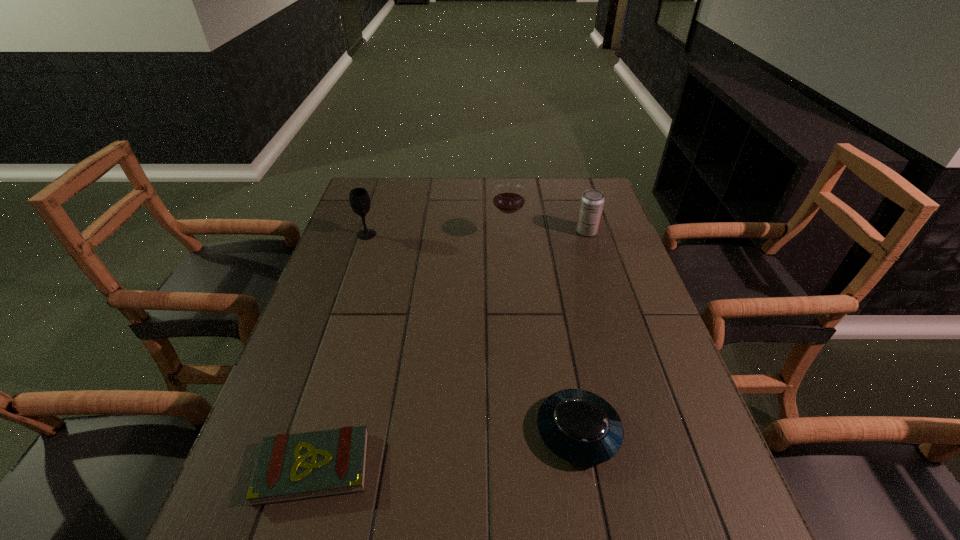
The image size is (960, 540). Identify the location of the right wineglass. (508, 198).

The height and width of the screenshot is (540, 960). Find the location of `the left wineglass`. the left wineglass is located at coordinates (359, 199).

Find the location of `soda`. soda is located at coordinates (592, 201).

Find the location of a particular element. The height and width of the screenshot is (540, 960). the fourth tallest object is located at coordinates (578, 426).

Where is `the shortest object`? The height and width of the screenshot is (540, 960). the shortest object is located at coordinates (289, 467).

The height and width of the screenshot is (540, 960). I want to click on free space located 0.100m on the right of the right wineglass, so click(554, 238).

This screenshot has width=960, height=540. Find the location of `free space located 0.260m on the back of the left wineglass`. free space located 0.260m on the back of the left wineglass is located at coordinates (382, 188).

You are a GUI agent. You are given a task and a screenshot of the screen. Output one action in this format:
    pyautogui.click(x=<x>, y=<y>)
    Task: Click on the free spot located on the left of the soda
    This screenshot has width=960, height=540.
    Given the screenshot: What is the action you would take?
    click(486, 231)

Find the location of a particular element. blank space located on the right of the saucer is located at coordinates (679, 431).

Image resolution: width=960 pixels, height=540 pixels. I want to click on vacant space located 0.080m on the right of the shortest object, so click(412, 467).